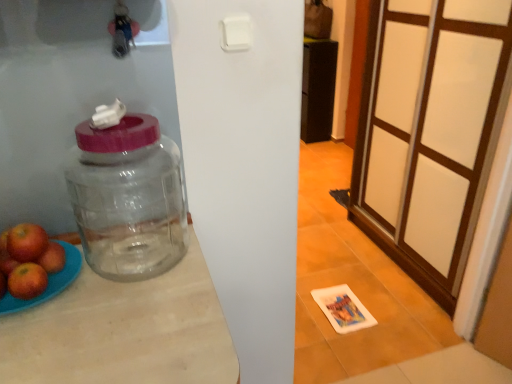
Question: Does red matte apple at left, which is the 1th apple in left-to-right order, have a lesser height compared to transparent glass jar at left?

Choices:
 (A) yes
 (B) no

Answer: (A)

Question: Is red matte apple at left, marked as the third apple in a right-to-left arrangement, positioned behind transparent glass jar at left?

Choices:
 (A) no
 (B) yes

Answer: (B)

Question: From the image's perspective, is red matte apple at left, marked as the third apple in a right-to-left arrangement, beneath transparent glass jar at left?

Choices:
 (A) no
 (B) yes

Answer: (B)

Question: Is transparent glass jar at left completely or partially inside red matte apple at left, marked as the third apple in a right-to-left arrangement?

Choices:
 (A) no
 (B) yes

Answer: (A)

Question: Is red matte apple at left, which is the 1th apple in left-to-right order, far from transparent glass jar at left?

Choices:
 (A) yes
 (B) no

Answer: (B)

Question: Looking at their shapes, would you say white frosted glass screen door at right is wider or thinner than red matte apple at left, marked as the third apple in a right-to-left arrangement?

Choices:
 (A) thin
 (B) wide

Answer: (A)

Question: Do you think white frosted glass screen door at right is within red matte apple at left, marked as the third apple in a right-to-left arrangement, or outside of it?

Choices:
 (A) inside
 (B) outside

Answer: (B)

Question: Considering their positions, is white frosted glass screen door at right located in front of or behind red matte apple at left, which is the 1th apple in left-to-right order?

Choices:
 (A) behind
 (B) front

Answer: (A)

Question: Is white frosted glass screen door at right taller or shorter than red matte apple at left, marked as the third apple in a right-to-left arrangement?

Choices:
 (A) short
 (B) tall

Answer: (B)

Question: Considering the positions of white frosted glass screen door at right and transparent glass jar at left in the image, is white frosted glass screen door at right wider or thinner than transparent glass jar at left?

Choices:
 (A) thin
 (B) wide

Answer: (A)

Question: Considering the positions of point (384, 182) and point (101, 130), is point (384, 182) closer or farther from the camera than point (101, 130)?

Choices:
 (A) closer
 (B) farther

Answer: (B)

Question: From the image's perspective, relative to transparent glass jar at left, is white frosted glass screen door at right above or below?

Choices:
 (A) below
 (B) above

Answer: (B)

Question: Based on their positions, is white frosted glass screen door at right located to the left or right of transparent glass jar at left?

Choices:
 (A) left
 (B) right

Answer: (B)

Question: Do you think red matte apple at left, which is counted as the second apple, starting from the right, is within transparent glass jar at left, or outside of it?

Choices:
 (A) outside
 (B) inside

Answer: (A)

Question: Considering the positions of point (24, 251) and point (162, 256), is point (24, 251) closer or farther from the camera than point (162, 256)?

Choices:
 (A) closer
 (B) farther

Answer: (A)